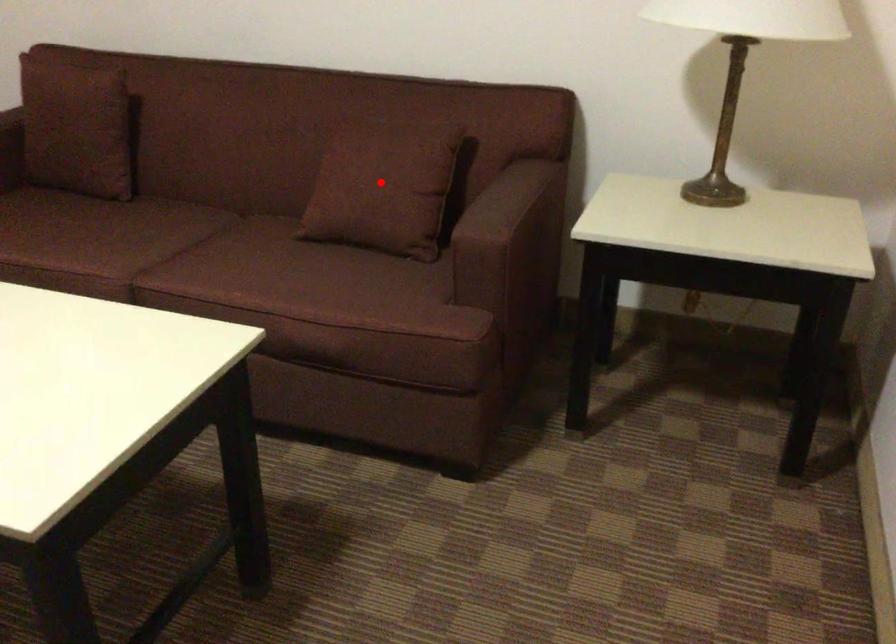
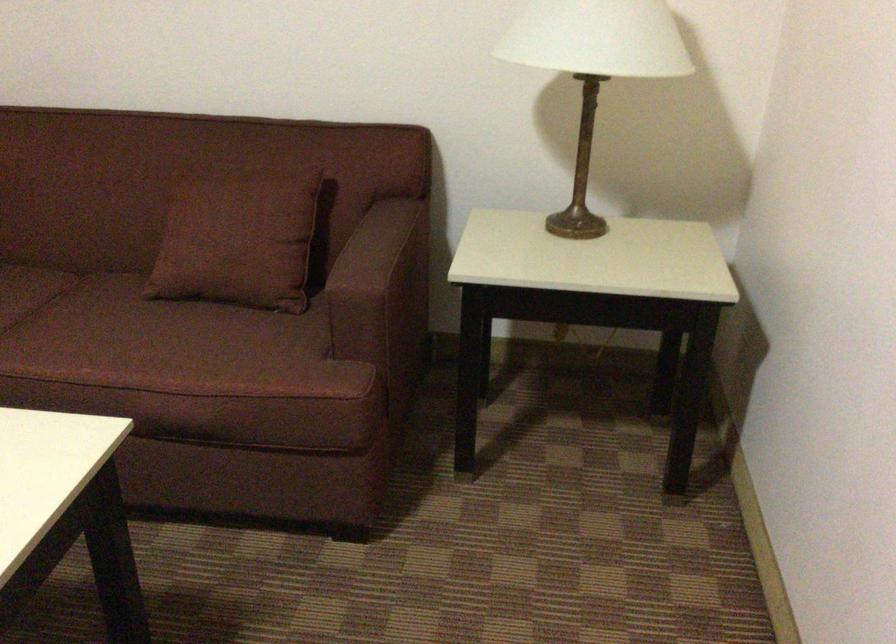
The point at the highlighted location is marked in the first image. Where is the corresponding point in the second image?

(238, 234)